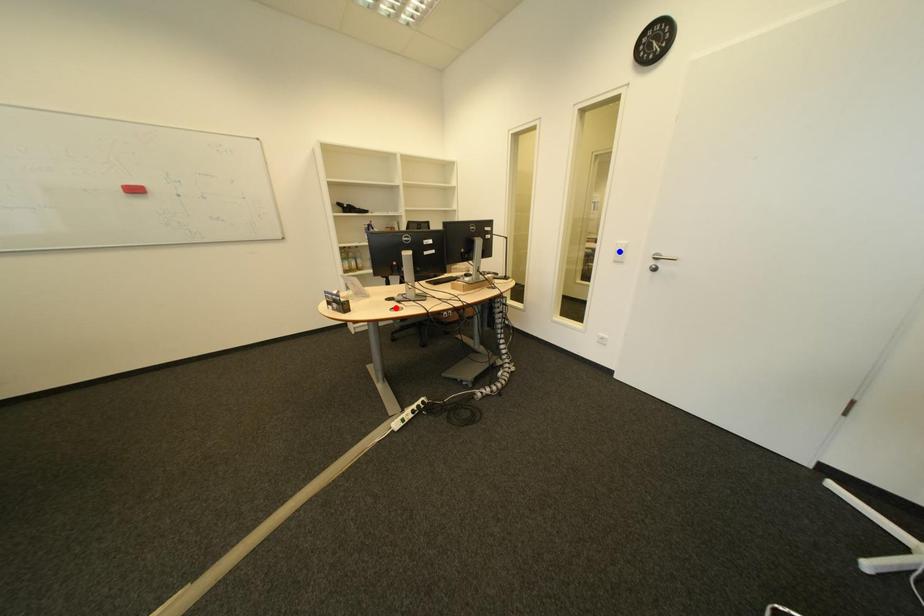
Question: In the image, two points are highlighted. Which point is nearer to the camera? Reply with the corresponding letter.

Choices:
 (A) blue point
 (B) red point

Answer: (B)